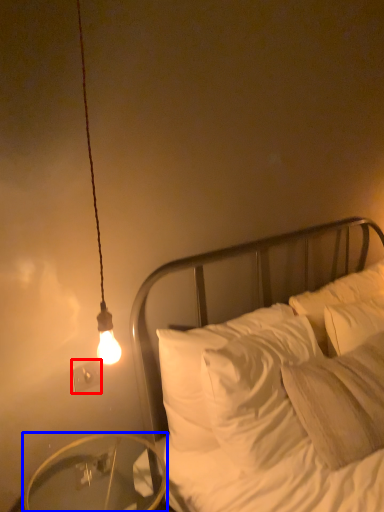
Question: Among these objects, which one is nearest to the camera, electric outlet (highlighted by a red box) or table (highlighted by a blue box)?

Choices:
 (A) electric outlet
 (B) table

Answer: (B)